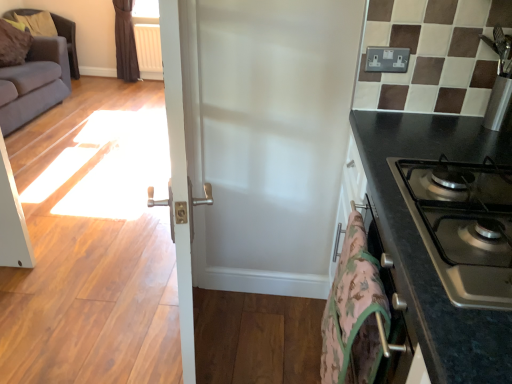
I want to click on free space to the left of white glossy door at center, so click(x=97, y=338).